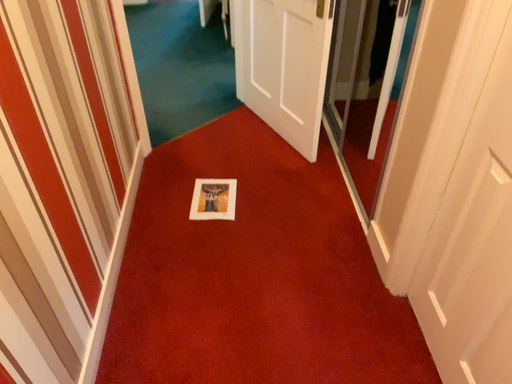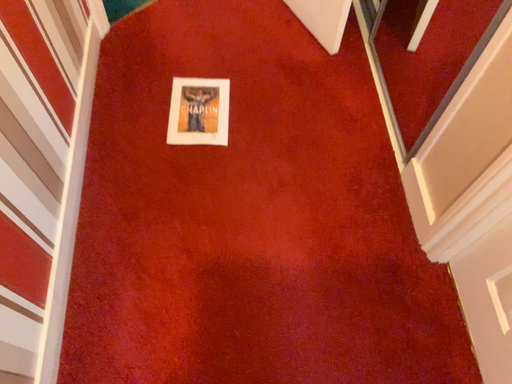
Question: Which way did the camera rotate in the video?

Choices:
 (A) rotated downward
 (B) rotated upward

Answer: (A)